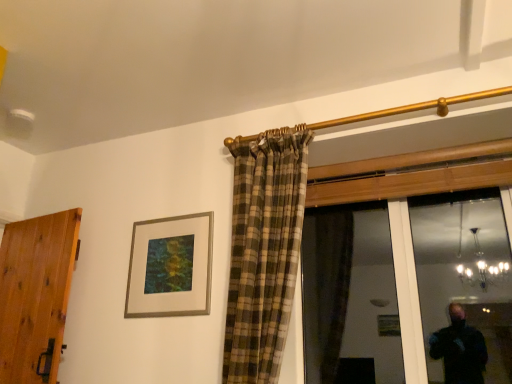
Question: Is point tap(72, 259) closer or farther from the camera than point tap(156, 279)?

Choices:
 (A) closer
 (B) farther

Answer: (B)

Question: Is wooden door at left situated inside silver metallic picture frame at upper center or outside?

Choices:
 (A) inside
 (B) outside

Answer: (B)

Question: Is wooden door at left in front of or behind silver metallic picture frame at upper center in the image?

Choices:
 (A) behind
 (B) front

Answer: (B)

Question: In the image, is silver metallic picture frame at upper center positioned in front of or behind wooden door at left?

Choices:
 (A) behind
 (B) front

Answer: (A)

Question: Is silver metallic picture frame at upper center wider or thinner than wooden door at left?

Choices:
 (A) thin
 (B) wide

Answer: (A)

Question: Visually, is silver metallic picture frame at upper center positioned to the left or to the right of wooden door at left?

Choices:
 (A) right
 (B) left

Answer: (A)

Question: In terms of height, does silver metallic picture frame at upper center look taller or shorter compared to wooden door at left?

Choices:
 (A) short
 (B) tall

Answer: (A)